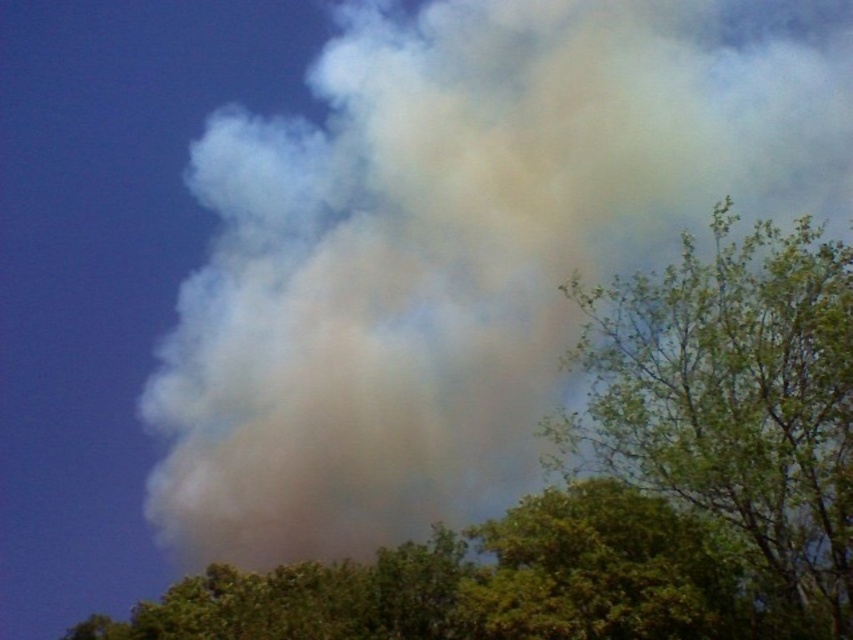
You are standing in a forest and see the green leafy tree at upper right and the green leafy tree at lower center in the distance. Which tree is higher up in the sky?

The green leafy tree at upper right is higher up in the sky than the green leafy tree at lower center.